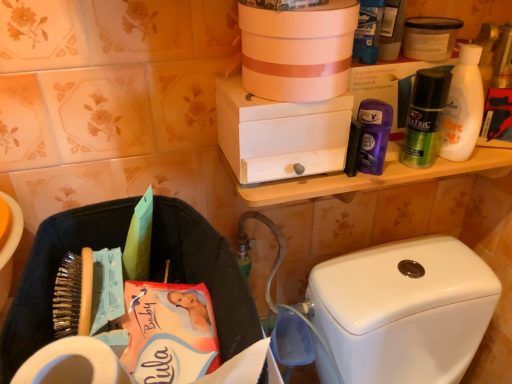
Question: From a real-world perspective, is white matte container at upper right positioned under white matte toilet paper at lower left based on gravity?

Choices:
 (A) no
 (B) yes

Answer: (A)

Question: Is white matte container at upper right placed right next to white matte toilet paper at lower left?

Choices:
 (A) no
 (B) yes

Answer: (A)

Question: Considering the relative sizes of white matte container at upper right and white matte toilet paper at lower left in the image provided, is white matte container at upper right thinner than white matte toilet paper at lower left?

Choices:
 (A) no
 (B) yes

Answer: (A)

Question: Would you say white matte toilet paper at lower left is part of white matte container at upper right's contents?

Choices:
 (A) yes
 (B) no

Answer: (B)

Question: Is the depth of white matte container at upper right greater than that of white matte toilet paper at lower left?

Choices:
 (A) no
 (B) yes

Answer: (B)

Question: Relative to matte white bucket at upper center, the 2th box from the bottom, is white matte box at upper center, acting as the 1th box starting from the bottom, in front or behind?

Choices:
 (A) behind
 (B) front

Answer: (A)

Question: Considering the positions of white matte box at upper center, the second box viewed from the top, and matte white bucket at upper center, the 1th box when ordered from top to bottom, in the image, is white matte box at upper center, the second box viewed from the top, wider or thinner than matte white bucket at upper center, the 1th box when ordered from top to bottom,?

Choices:
 (A) wide
 (B) thin

Answer: (A)

Question: Looking at the image, does white matte box at upper center, acting as the 1th box starting from the bottom, seem bigger or smaller compared to matte white bucket at upper center, the 1th box when ordered from top to bottom?

Choices:
 (A) small
 (B) big

Answer: (B)

Question: Considering the positions of white matte box at upper center, acting as the 1th box starting from the bottom, and matte white bucket at upper center, the 1th box when ordered from top to bottom, in the image, is white matte box at upper center, acting as the 1th box starting from the bottom, taller or shorter than matte white bucket at upper center, the 1th box when ordered from top to bottom,?

Choices:
 (A) tall
 (B) short

Answer: (A)

Question: From their relative heights in the image, would you say white matte container at upper right is taller or shorter than white glossy toilet tank at lower right?

Choices:
 (A) tall
 (B) short

Answer: (B)

Question: Considering the positions of white matte container at upper right and white glossy toilet tank at lower right in the image, is white matte container at upper right bigger or smaller than white glossy toilet tank at lower right?

Choices:
 (A) big
 (B) small

Answer: (B)

Question: Is white matte container at upper right wider or thinner than white glossy toilet tank at lower right?

Choices:
 (A) wide
 (B) thin

Answer: (B)

Question: Considering their positions, is white matte container at upper right located in front of or behind white glossy toilet tank at lower right?

Choices:
 (A) front
 (B) behind

Answer: (B)

Question: In terms of size, does white matte box at upper center, the second box viewed from the top, appear bigger or smaller than white glossy toilet tank at lower right?

Choices:
 (A) small
 (B) big

Answer: (A)

Question: Would you say white matte box at upper center, the second box viewed from the top, is inside or outside white glossy toilet tank at lower right?

Choices:
 (A) inside
 (B) outside

Answer: (B)